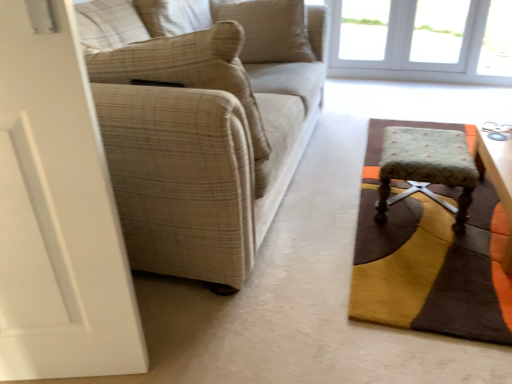
Question: Can you confirm if textured brown rug at lower right is taller than beige plaid fabric couch at left?

Choices:
 (A) no
 (B) yes

Answer: (A)

Question: Considering the relative positions of textured brown rug at lower right and beige plaid fabric couch at left in the image provided, is textured brown rug at lower right to the left of beige plaid fabric couch at left from the viewer's perspective?

Choices:
 (A) no
 (B) yes

Answer: (A)

Question: From a real-world perspective, is textured brown rug at lower right positioned over beige plaid fabric couch at left based on gravity?

Choices:
 (A) no
 (B) yes

Answer: (A)

Question: Can we say textured brown rug at lower right lies outside beige plaid fabric couch at left?

Choices:
 (A) yes
 (B) no

Answer: (A)

Question: Is the depth of textured brown rug at lower right greater than that of beige plaid fabric couch at left?

Choices:
 (A) no
 (B) yes

Answer: (B)

Question: Does textured brown rug at lower right have a lesser height compared to beige plaid fabric couch at left?

Choices:
 (A) no
 (B) yes

Answer: (B)

Question: Is floral fabric stool at lower right outside of beige textured pillow at left, which is the 1th pillow from bottom to top?

Choices:
 (A) yes
 (B) no

Answer: (A)

Question: Is floral fabric stool at lower right beside beige textured pillow at left, which is the 1th pillow from bottom to top?

Choices:
 (A) no
 (B) yes

Answer: (A)

Question: Is floral fabric stool at lower right wider than beige textured pillow at left, which appears as the 2th pillow when viewed from the back?

Choices:
 (A) yes
 (B) no

Answer: (A)

Question: Is the position of floral fabric stool at lower right less distant than that of beige textured pillow at left, which is the 1th pillow from bottom to top?

Choices:
 (A) yes
 (B) no

Answer: (B)

Question: From a real-world perspective, does floral fabric stool at lower right stand above beige textured pillow at left, the first pillow from the front?

Choices:
 (A) no
 (B) yes

Answer: (A)

Question: Is beige textured pillow at left, which is the 1th pillow from bottom to top, at the back of floral fabric stool at lower right?

Choices:
 (A) yes
 (B) no

Answer: (B)

Question: Can you confirm if beige plaid fabric couch at left is wider than beige textured pillow at left, which appears as the 2th pillow when viewed from the back?

Choices:
 (A) yes
 (B) no

Answer: (A)